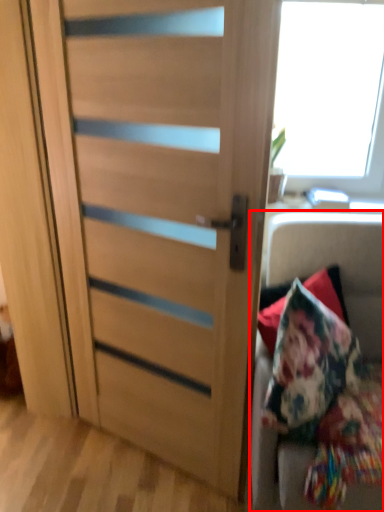
Question: From the image's perspective, where is furniture (annotated by the red box) located in relation to door in the image?

Choices:
 (A) above
 (B) below

Answer: (B)